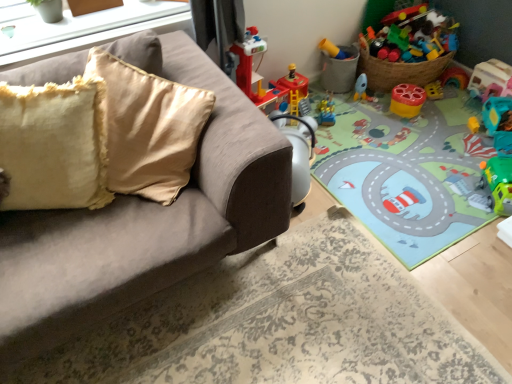
Where is `vacant area to the right of translucent plastic toy at center, which is the sixth toy in right-to-left order`? vacant area to the right of translucent plastic toy at center, which is the sixth toy in right-to-left order is located at coordinates (358, 115).